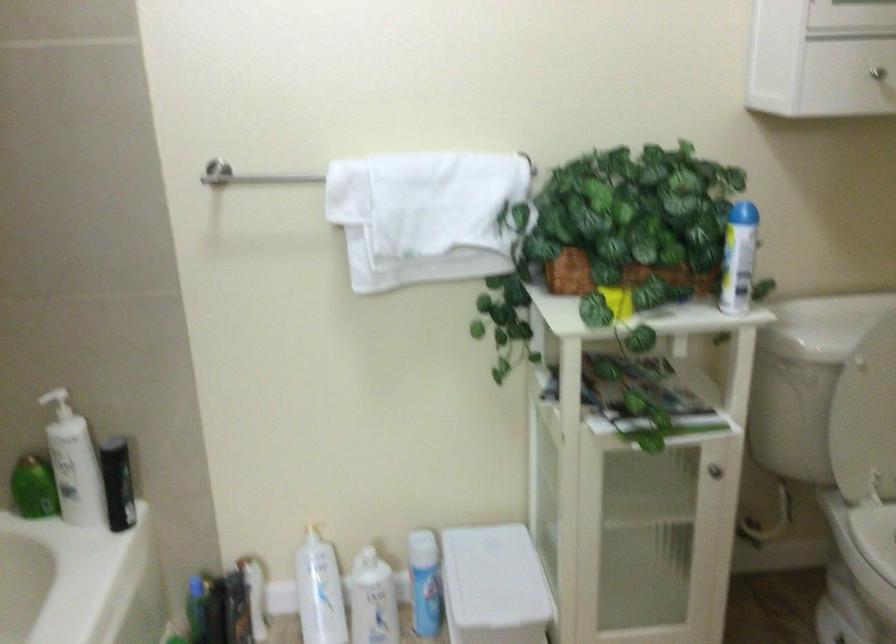
Identify the location of small cabinet knob. This screenshot has height=644, width=896. (713, 469).